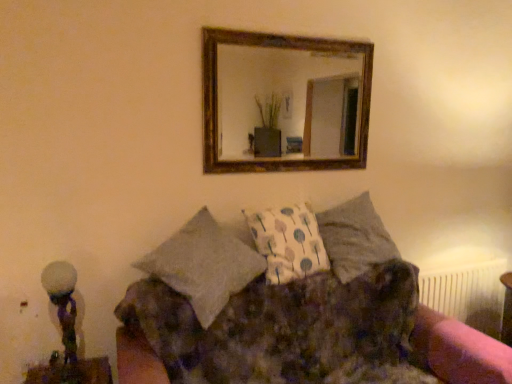
Question: In terms of width, does white frosted glass at left look wider or thinner when compared to textured gray pillow at center?

Choices:
 (A) wide
 (B) thin

Answer: (B)

Question: Considering the positions of point (67, 327) and point (349, 246), is point (67, 327) closer or farther from the camera than point (349, 246)?

Choices:
 (A) closer
 (B) farther

Answer: (A)

Question: Which object is positioned farthest from the white plastic radiator at lower right?

Choices:
 (A) white frosted glass at left
 (B) textured gray pillow at center
 (C) wooden-framed mirror at upper center
 (D) fluffy fabric couch at center

Answer: (C)

Question: Estimate the real-world distances between objects in this image. Which object is closer to the white frosted glass at left?

Choices:
 (A) textured gray pillow at center
 (B) fluffy fabric couch at center
 (C) white plastic radiator at lower right
 (D) wooden-framed mirror at upper center

Answer: (B)